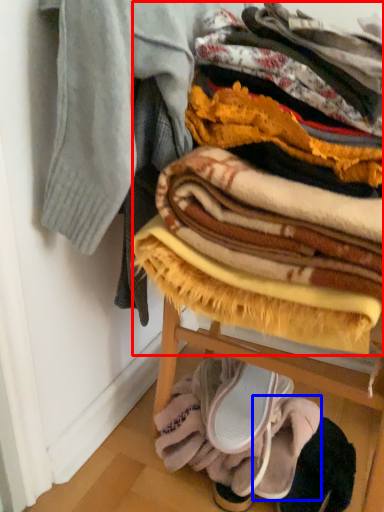
Question: Which point is closer to the camera, blanket (highlighted by a red box) or footwear (highlighted by a blue box)?

Choices:
 (A) blanket
 (B) footwear

Answer: (A)